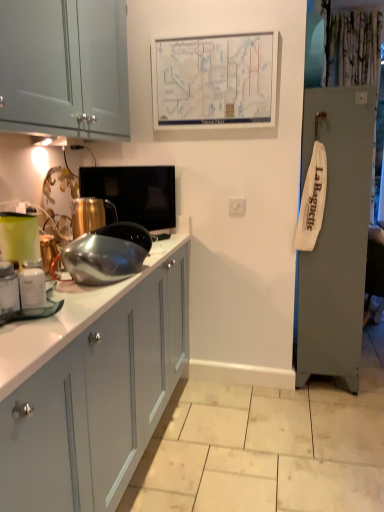
Question: Are matte green plastic container at left and matte white salt shaker at left located far from each other?

Choices:
 (A) no
 (B) yes

Answer: (A)

Question: Is matte green plastic container at left smaller than matte white salt shaker at left?

Choices:
 (A) yes
 (B) no

Answer: (B)

Question: Considering the relative sizes of matte green plastic container at left and matte white salt shaker at left in the image provided, is matte green plastic container at left shorter than matte white salt shaker at left?

Choices:
 (A) yes
 (B) no

Answer: (B)

Question: Does matte green plastic container at left have a larger size compared to matte white salt shaker at left?

Choices:
 (A) no
 (B) yes

Answer: (B)

Question: Is matte green plastic container at left to the left of matte white salt shaker at left from the viewer's perspective?

Choices:
 (A) yes
 (B) no

Answer: (A)

Question: Is matte white salt shaker at left at the back of matte green plastic container at left?

Choices:
 (A) yes
 (B) no

Answer: (B)

Question: Considering the relative sizes of white paper map at upper center and shiny metallic bowl at center, which is the third appliance from back to front, in the image provided, is white paper map at upper center bigger than shiny metallic bowl at center, which is the third appliance from back to front,?

Choices:
 (A) no
 (B) yes

Answer: (B)

Question: Is white paper map at upper center positioned with its back to shiny metallic bowl at center, which is the third appliance from back to front?

Choices:
 (A) yes
 (B) no

Answer: (B)

Question: Is white paper map at upper center next to shiny metallic bowl at center, which is the third appliance from back to front, and touching it?

Choices:
 (A) yes
 (B) no

Answer: (B)

Question: Can you confirm if white paper map at upper center is thinner than shiny metallic bowl at center, which is counted as the 2th appliance, starting from the front?

Choices:
 (A) no
 (B) yes

Answer: (B)

Question: Does white paper map at upper center have a lesser height compared to shiny metallic bowl at center, which is counted as the 2th appliance, starting from the front?

Choices:
 (A) no
 (B) yes

Answer: (A)

Question: Is white paper map at upper center completely or partially outside of shiny metallic bowl at center, which is counted as the 2th appliance, starting from the front?

Choices:
 (A) yes
 (B) no

Answer: (A)

Question: Does shiny metallic bowl at center, which is the third appliance from back to front, appear on the right side of white glossy jar at left, the fourth appliance from the back?

Choices:
 (A) yes
 (B) no

Answer: (A)